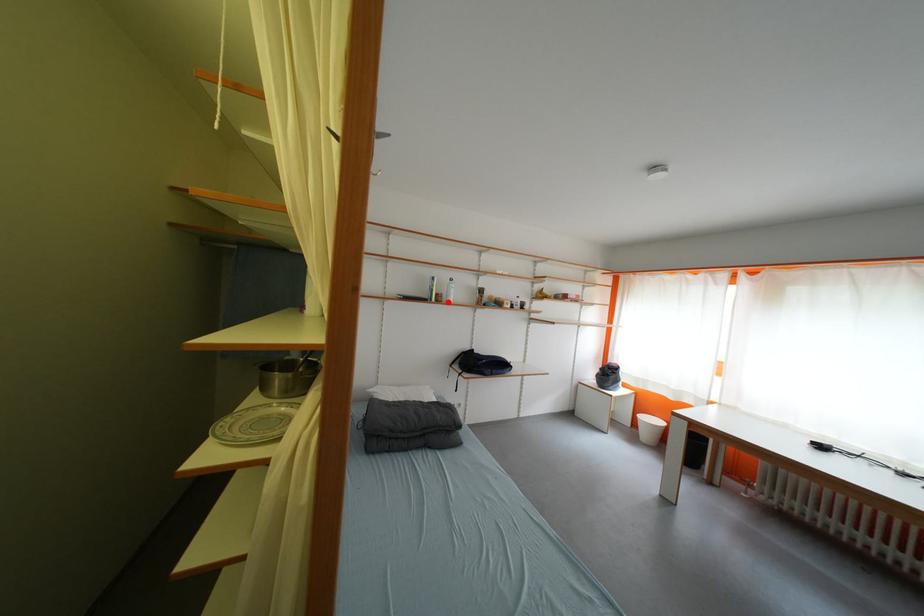
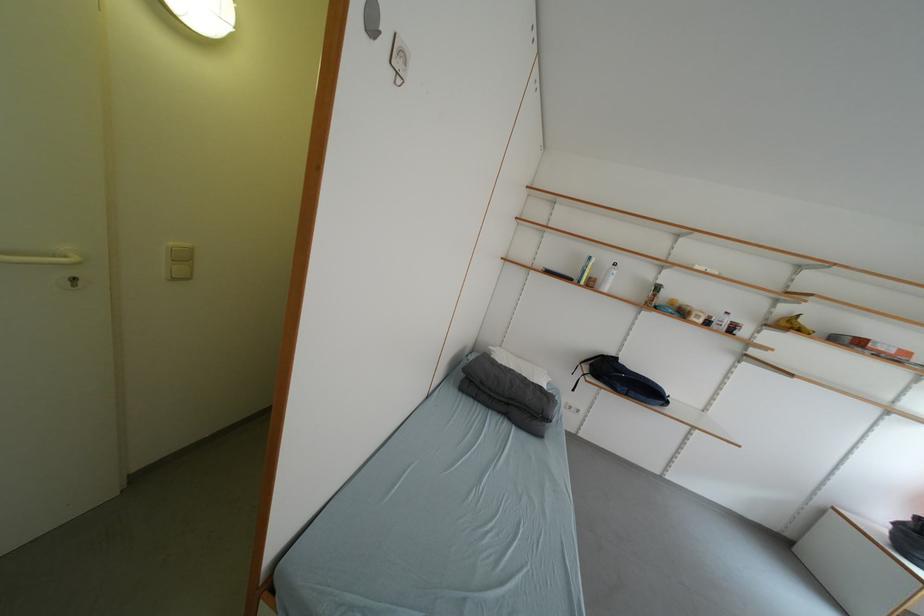
Question: I am providing you with two images of the same scene from different viewpoints. A red point is marked on the first image. Is the red point's position out of view in image 2?

Choices:
 (A) Yes
 (B) No

Answer: (B)